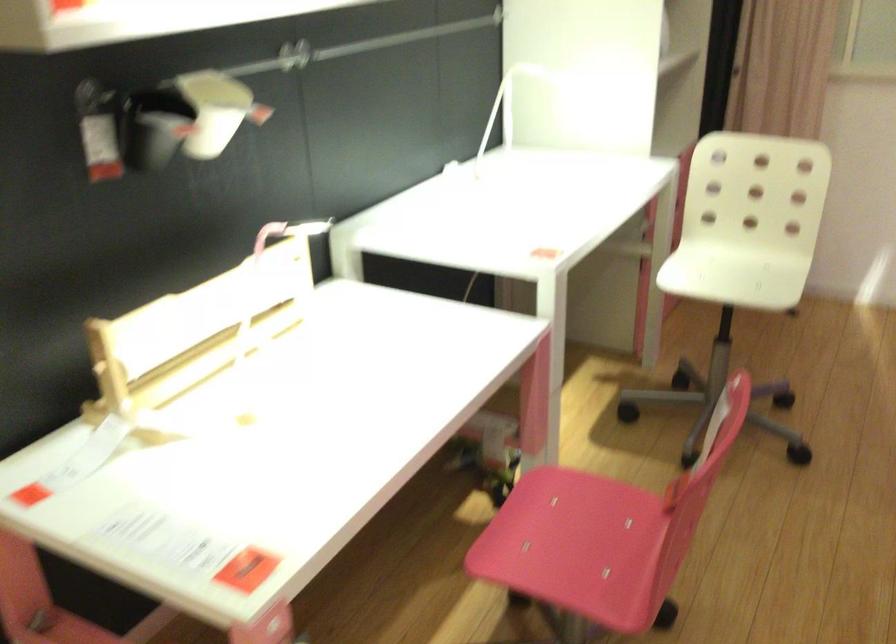
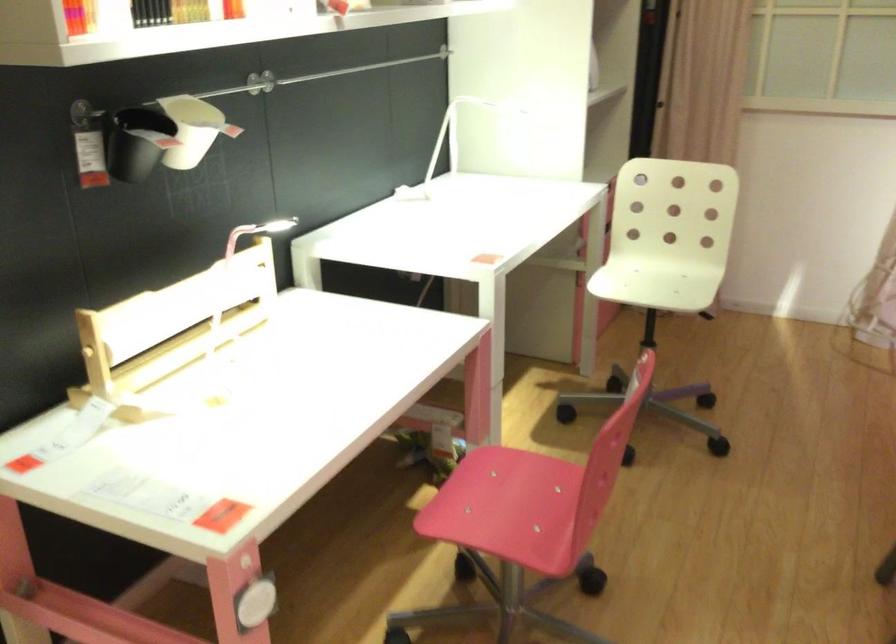
Find the pixel in the second image that matches (572,509) in the first image.

(511, 482)